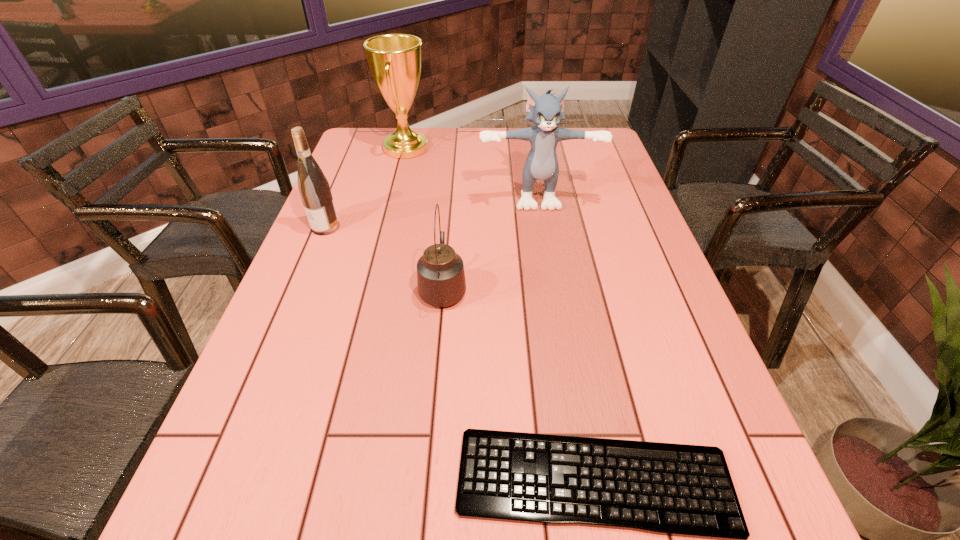
The height and width of the screenshot is (540, 960). I want to click on vacant space located 0.380m spout on the kettle, so click(452, 184).

Identify the location of vacant region located 0.270m spout on the kettle. click(x=450, y=204).

Locate an element on the screen. This screenshot has height=540, width=960. vacant point located spout on the kettle is located at coordinates (450, 200).

Locate an element on the screen. object that is positioned at the far edge is located at coordinates (394, 60).

Where is `award at the left edge`? The image size is (960, 540). award at the left edge is located at coordinates (394, 60).

Identify the location of wine bottle present at the left edge. The width and height of the screenshot is (960, 540). (313, 186).

I want to click on object that is at the right edge, so click(x=545, y=111).

Where is `object positioned at the far left corner`? The height and width of the screenshot is (540, 960). object positioned at the far left corner is located at coordinates (394, 60).

Identify the location of vacant space at the far edge of the desktop. The width and height of the screenshot is (960, 540). (510, 145).

Where is `vacant region at the near edge of the desktop`? vacant region at the near edge of the desktop is located at coordinates (336, 524).